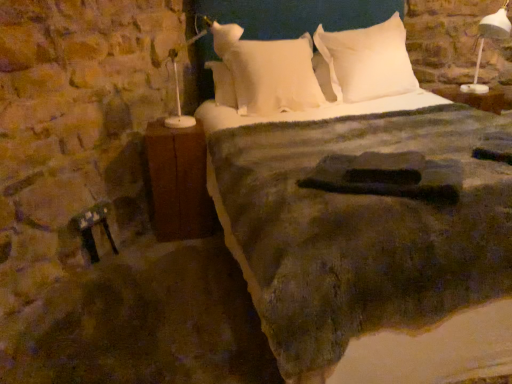
Question: In terms of size, does white soft pillow at upper center, the second pillow when ordered from left to right, appear bigger or smaller than white soft pillow at center, the 2th pillow positioned from the right?

Choices:
 (A) small
 (B) big

Answer: (A)

Question: In the image, is white soft pillow at upper center, which is the 1th pillow in right-to-left order, positioned in front of or behind white soft pillow at center, which is the 1th pillow in left-to-right order?

Choices:
 (A) front
 (B) behind

Answer: (B)

Question: Based on their relative distances, which object is farther from the white plastic lamp at upper right?

Choices:
 (A) white soft pillow at center, which is the 1th pillow in left-to-right order
 (B) white soft pillow at upper center, which is the 1th pillow in right-to-left order
 (C) brown wood nightstand at left
 (D) textured woolen blanket at center

Answer: (C)

Question: Which is nearer to the white soft pillow at center, the 2th pillow positioned from the right?

Choices:
 (A) brown wood nightstand at left
 (B) textured woolen blanket at center
 (C) white soft pillow at upper center, the second pillow when ordered from left to right
 (D) white plastic lamp at upper right

Answer: (C)